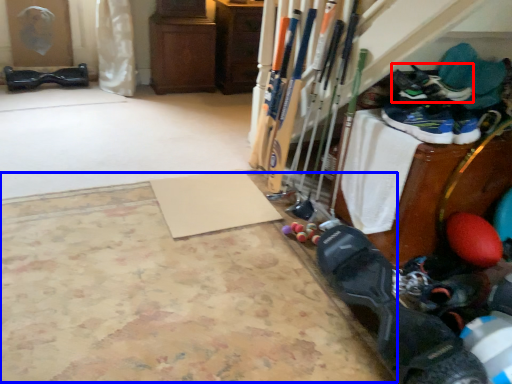
Question: Which object is closer to the camera taking this photo, footwear (highlighted by a red box) or yoga mat (highlighted by a blue box)?

Choices:
 (A) footwear
 (B) yoga mat

Answer: (B)